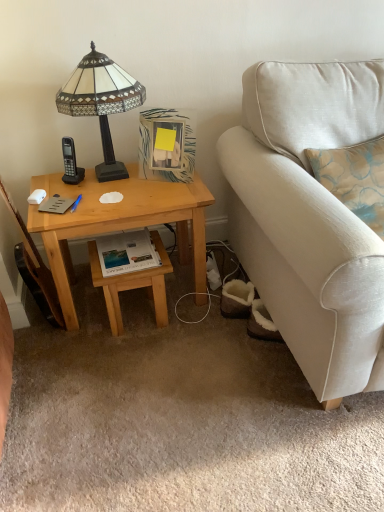
Image resolution: width=384 pixels, height=512 pixels. In order to click on free space in front of stained glass lampshade at upper left in this screenshot , I will do `click(110, 201)`.